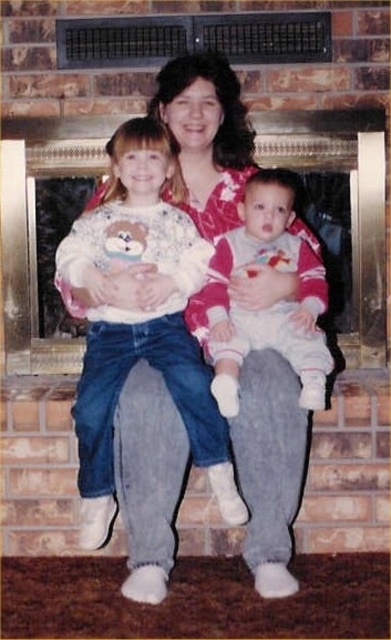
What is the 2D coordinate of the white fleece sweater at center?

The white fleece sweater at center is located at the 2D coordinate point of (141, 326).

You are a photographer who wants to take a clear photo of both the white fleece sweater at center and the white soft baby at center. Since they are both at the center, which one should you focus on to ensure the other is also in focus?

The white fleece sweater at center is in front of the white soft baby at center, so focusing on the white fleece sweater at center will ensure the white soft baby at center is also in focus.